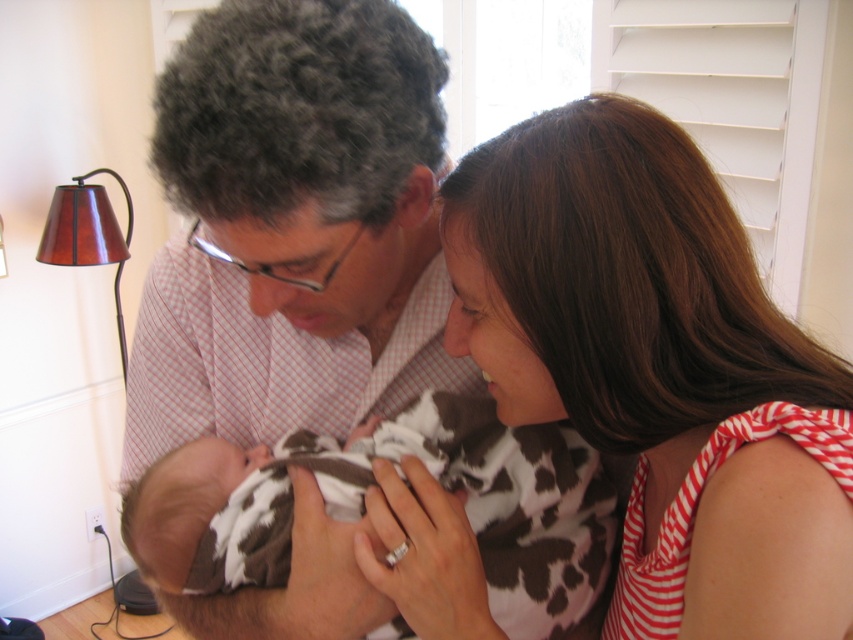
Question: In this image, where is matte pink shirt at center located relative to cow print fabric at center?

Choices:
 (A) below
 (B) above

Answer: (B)

Question: Which object is the closest to the cow print fabric at center?

Choices:
 (A) striped fabric dress at center
 (B) matte pink shirt at center

Answer: (B)

Question: Considering the relative positions of matte pink shirt at center and striped fabric dress at center in the image provided, where is matte pink shirt at center located with respect to striped fabric dress at center?

Choices:
 (A) above
 (B) below

Answer: (A)

Question: Can you confirm if matte pink shirt at center is positioned to the left of cow print fabric at center?

Choices:
 (A) yes
 (B) no

Answer: (A)

Question: Which object is positioned closest to the cow print fabric at center?

Choices:
 (A) matte pink shirt at center
 (B) striped fabric dress at center

Answer: (A)

Question: Which object is farther from the camera taking this photo?

Choices:
 (A) striped fabric dress at center
 (B) cow print fabric at center

Answer: (B)